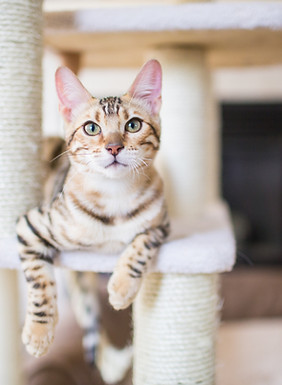
Where is `cat climber`? cat climber is located at coordinates (188, 308).